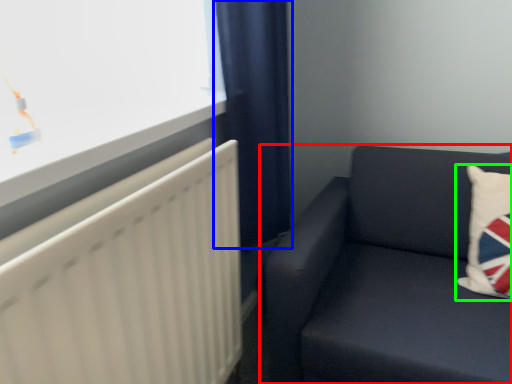
Question: Considering the real-world distances, which object is closest to studio couch (highlighted by a red box)? curtain (highlighted by a blue box) or pillow (highlighted by a green box).

Choices:
 (A) curtain
 (B) pillow

Answer: (B)